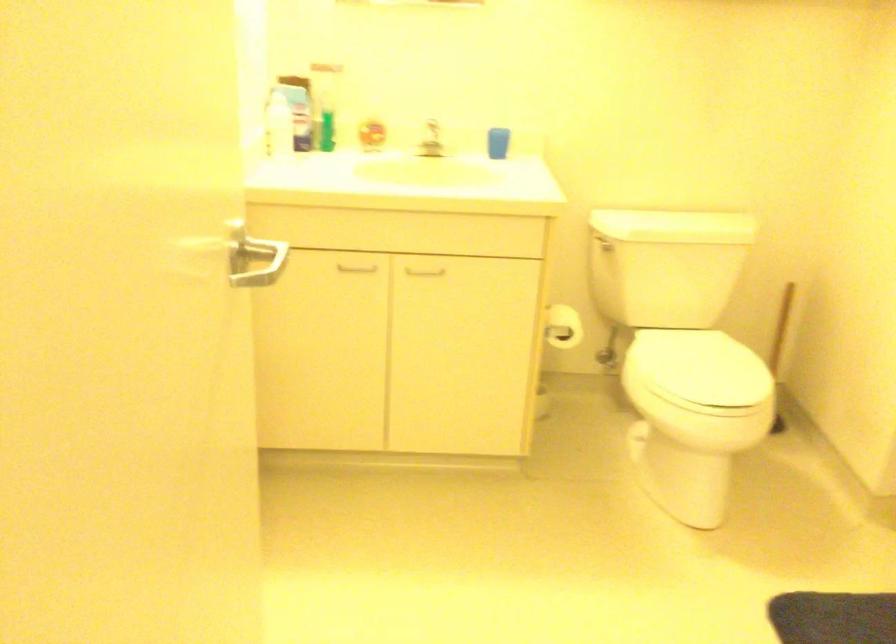
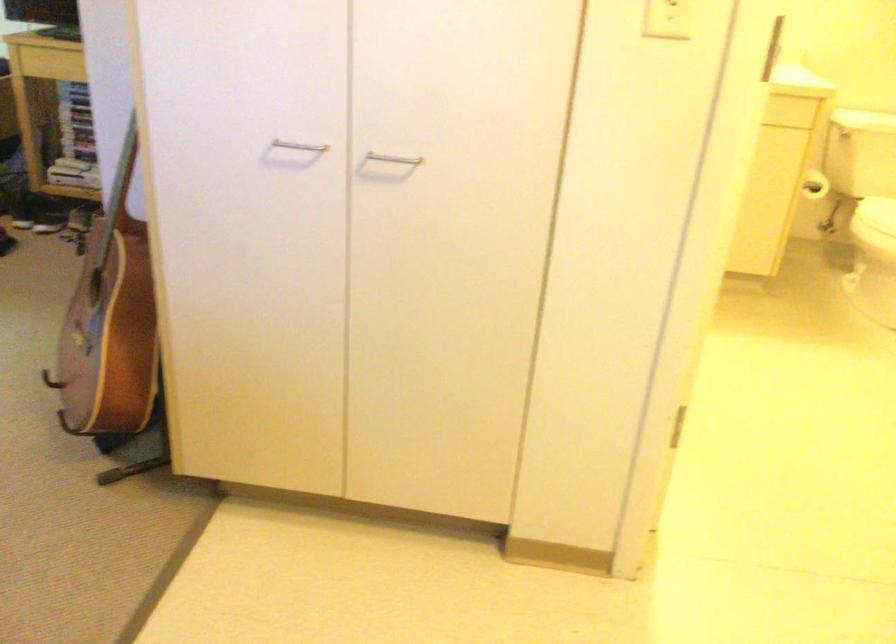
Locate, in the second image, the point that corresponds to pixel 648 388 in the first image.

(876, 214)